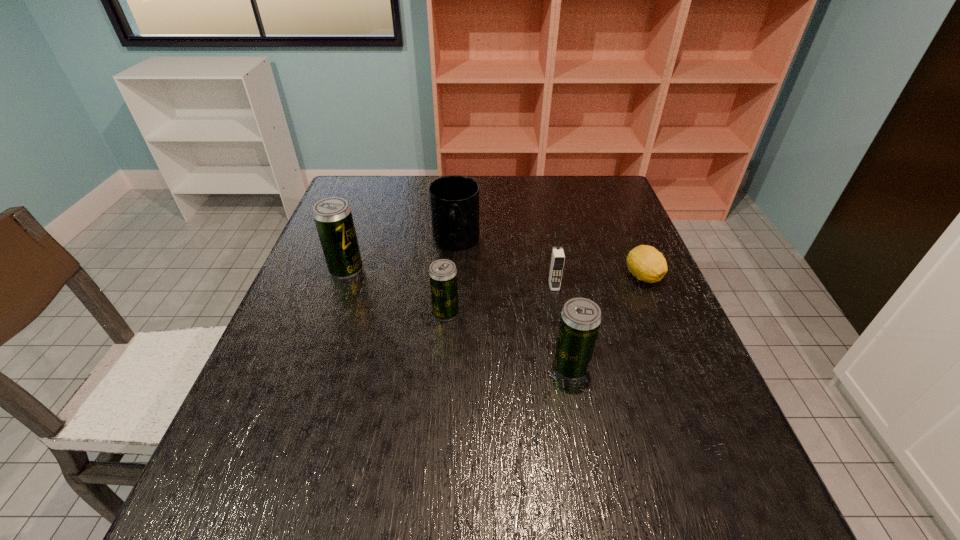
Identify the location of unoccupied area between the shortest object and the second farthest beer can. The width and height of the screenshot is (960, 540). (544, 294).

Where is `vacant point located between the shortest object and the fifth farthest object`? vacant point located between the shortest object and the fifth farthest object is located at coordinates (544, 294).

Identify the location of unoccupied position between the leftmost object and the second beer can from right to left. (396, 291).

Find the location of a particular element. The height and width of the screenshot is (540, 960). unoccupied area between the mug and the shortest object is located at coordinates (549, 259).

In order to click on the third closest object to the cellular telephone in this screenshot , I will do `click(580, 319)`.

Identify which object is the second nearest to the farthest beer can. Please provide its 2D coordinates. Your answer should be formatted as a tuple, i.e. [(x, y)], where the tuple contains the x and y coordinates of a point satisfying the conditions above.

[(443, 281)]

The image size is (960, 540). I want to click on beer can that is the second nearest to the fifth farthest object, so click(580, 319).

Where is `beer can identified as the second closest to the mug`? The height and width of the screenshot is (540, 960). beer can identified as the second closest to the mug is located at coordinates (333, 218).

Where is `vacant space that satisfies the following two spatial constraints: 1. on the front-facing side of the cellular telephone; 2. on the right side of the second tallest beer can`? This screenshot has height=540, width=960. vacant space that satisfies the following two spatial constraints: 1. on the front-facing side of the cellular telephone; 2. on the right side of the second tallest beer can is located at coordinates (569, 367).